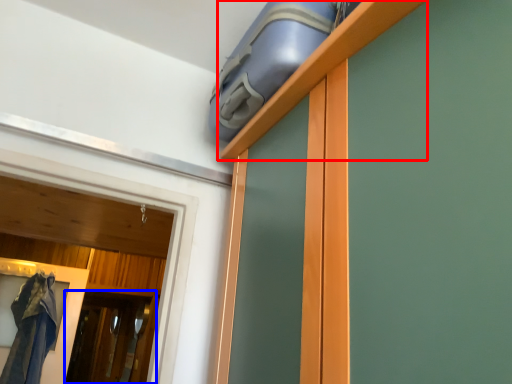
Question: Which of the following is the farthest to the observer, shelf (highlighted by a red box) or screen door (highlighted by a blue box)?

Choices:
 (A) shelf
 (B) screen door

Answer: (B)